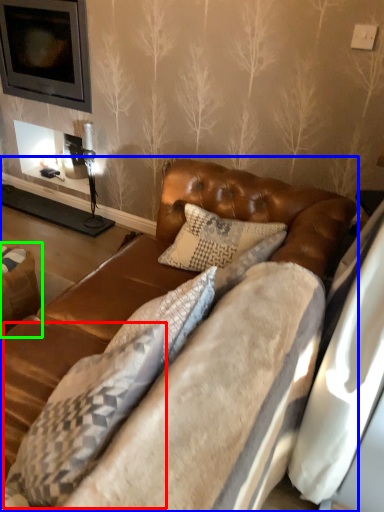
Question: Which object is the closest to the pillow (highlighted by a red box)? Choose among these: studio couch (highlighted by a blue box) or swivel chair (highlighted by a green box).

Choices:
 (A) studio couch
 (B) swivel chair

Answer: (A)